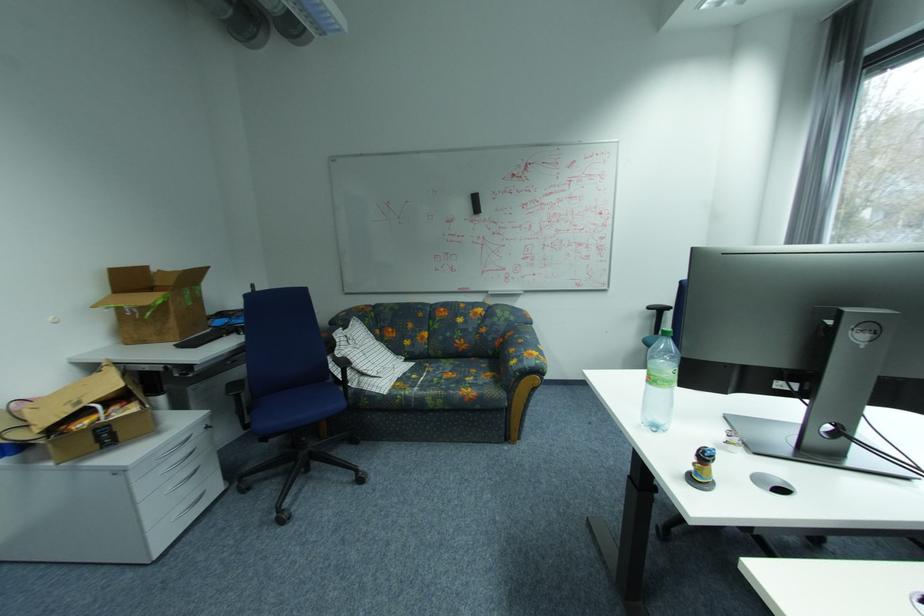
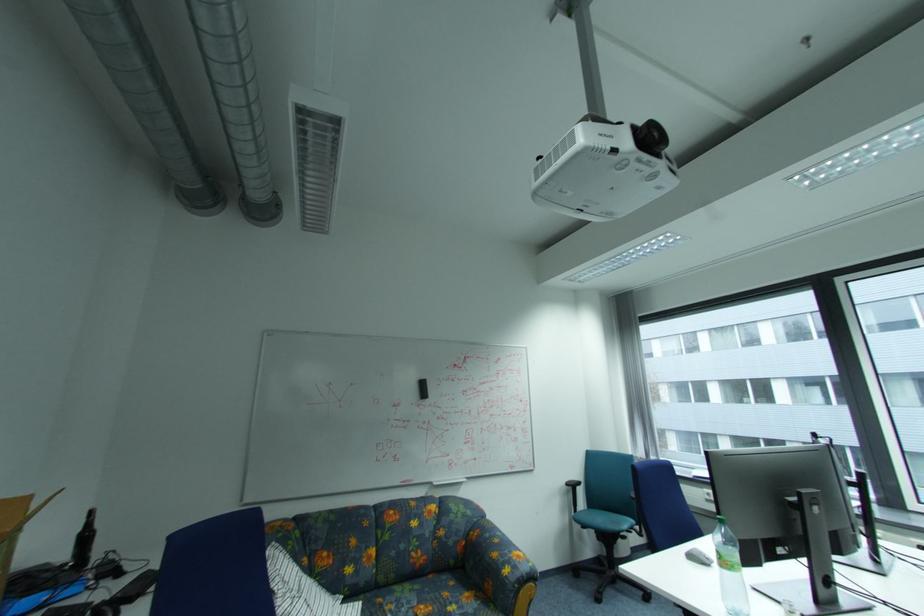
In the second image, find the point that corresponds to [661,379] in the first image.

(736, 562)